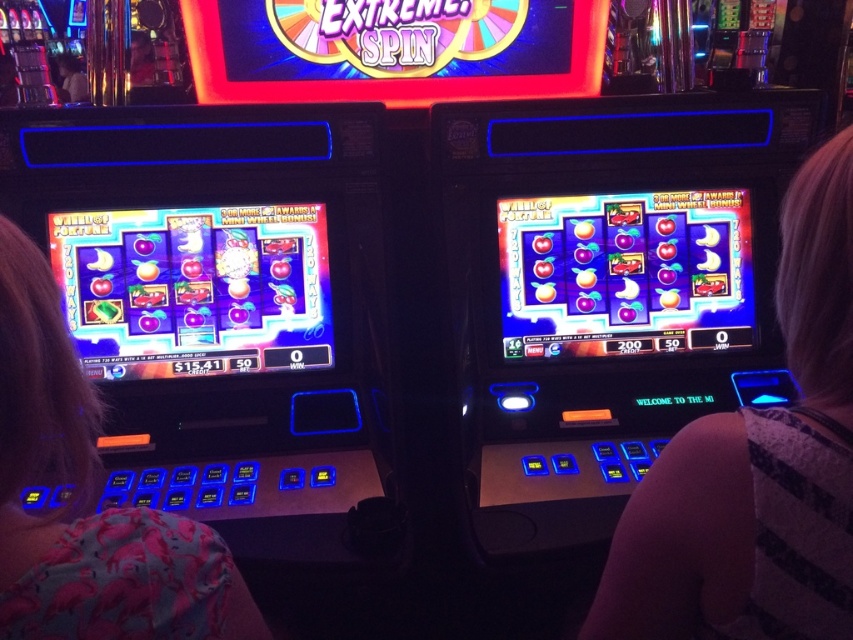
Question: Can you confirm if striped fabric shoulder at right is thinner than pink fabric shirt at left?

Choices:
 (A) no
 (B) yes

Answer: (A)

Question: Does striped fabric shoulder at right appear on the right side of pink fabric shirt at left?

Choices:
 (A) yes
 (B) no

Answer: (A)

Question: Which point is closer to the camera?

Choices:
 (A) click(6, 282)
 (B) click(601, 620)

Answer: (A)

Question: Does striped fabric shoulder at right appear over pink fabric shirt at left?

Choices:
 (A) no
 (B) yes

Answer: (B)